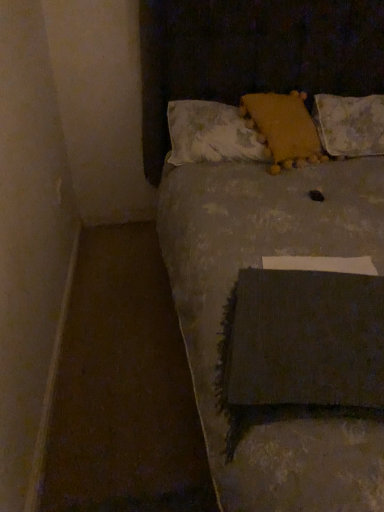
Question: Does fluffy white pillow at upper center, which ranks as the third pillow in right-to-left order, have a greater height compared to textured gray blanket at center?

Choices:
 (A) yes
 (B) no

Answer: (B)

Question: Is fluffy white pillow at upper center, which ranks as the third pillow in right-to-left order, positioned before textured gray blanket at center?

Choices:
 (A) yes
 (B) no

Answer: (B)

Question: Does fluffy white pillow at upper center, the 1th pillow when ordered from left to right, have a greater width compared to textured gray blanket at center?

Choices:
 (A) no
 (B) yes

Answer: (A)

Question: Is fluffy white pillow at upper center, the 1th pillow when ordered from left to right, further to the viewer compared to textured gray blanket at center?

Choices:
 (A) yes
 (B) no

Answer: (A)

Question: Considering the relative sizes of fluffy white pillow at upper center, which ranks as the third pillow in right-to-left order, and textured gray blanket at center in the image provided, is fluffy white pillow at upper center, which ranks as the third pillow in right-to-left order, bigger than textured gray blanket at center?

Choices:
 (A) yes
 (B) no

Answer: (B)

Question: Is yellow fuzzy pillow at upper center, acting as the second pillow starting from the right, to the right of textured gray blanket at center from the viewer's perspective?

Choices:
 (A) yes
 (B) no

Answer: (B)

Question: Does yellow fuzzy pillow at upper center, the second pillow when ordered from left to right, appear on the left side of textured gray blanket at center?

Choices:
 (A) no
 (B) yes

Answer: (B)

Question: Considering the relative sizes of yellow fuzzy pillow at upper center, acting as the second pillow starting from the right, and textured gray blanket at center in the image provided, is yellow fuzzy pillow at upper center, acting as the second pillow starting from the right, wider than textured gray blanket at center?

Choices:
 (A) no
 (B) yes

Answer: (A)

Question: Is yellow fuzzy pillow at upper center, acting as the second pillow starting from the right, placed right next to textured gray blanket at center?

Choices:
 (A) no
 (B) yes

Answer: (A)

Question: Is yellow fuzzy pillow at upper center, the second pillow when ordered from left to right, taller than textured gray blanket at center?

Choices:
 (A) yes
 (B) no

Answer: (B)

Question: Is textured gray blanket at center surrounded by yellow fuzzy pillow at upper center, the second pillow when ordered from left to right?

Choices:
 (A) no
 (B) yes

Answer: (A)

Question: Is white textured pillow at upper right, which is the third pillow in left-to-right order, outside yellow fuzzy pillow at upper center, the second pillow when ordered from left to right?

Choices:
 (A) yes
 (B) no

Answer: (A)